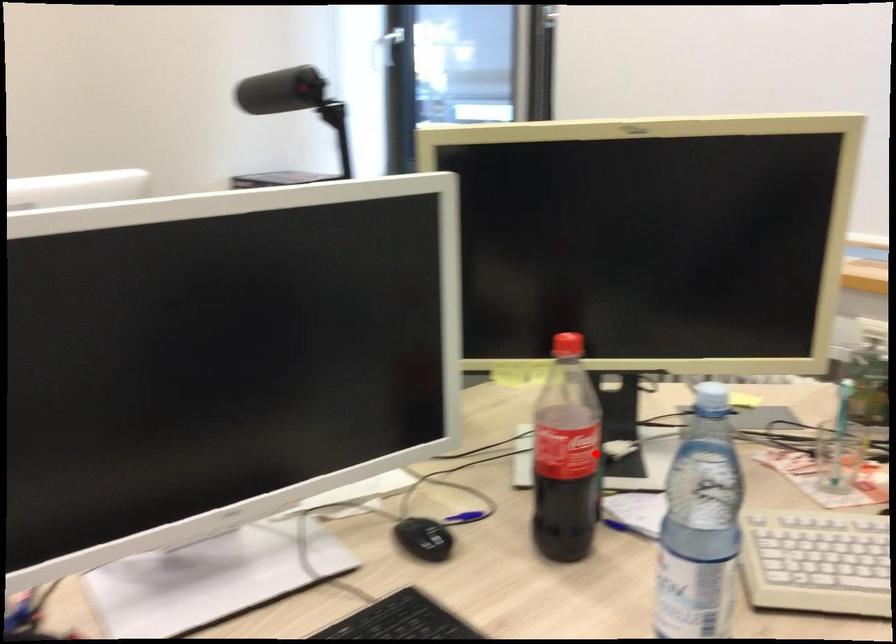
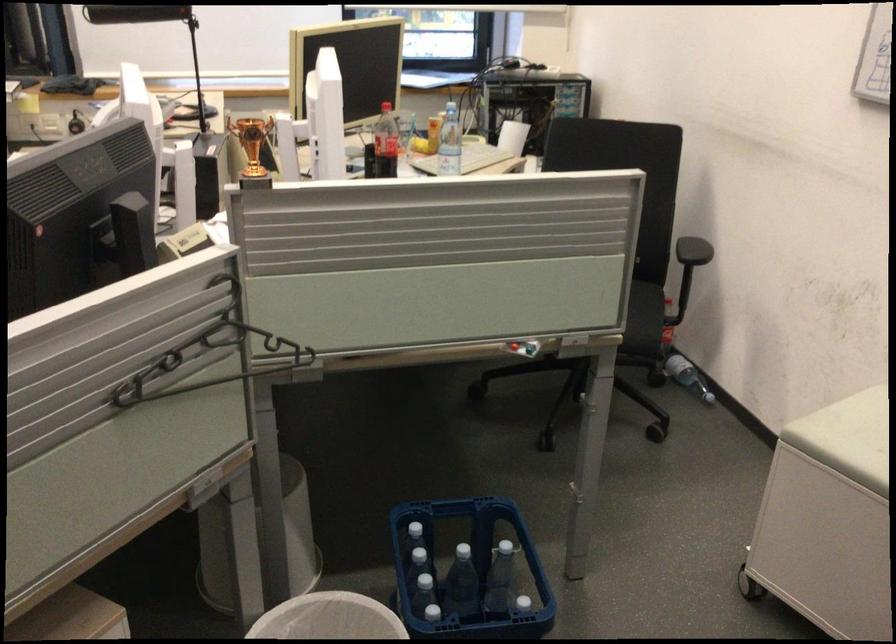
Question: I am providing you with two images of the same scene from different viewpoints. Image1 has a red point marked. In image2, the corresponding 3D location appears at what relative position? Reply with the corresponding letter.

Choices:
 (A) Closer
 (B) Farther

Answer: (B)